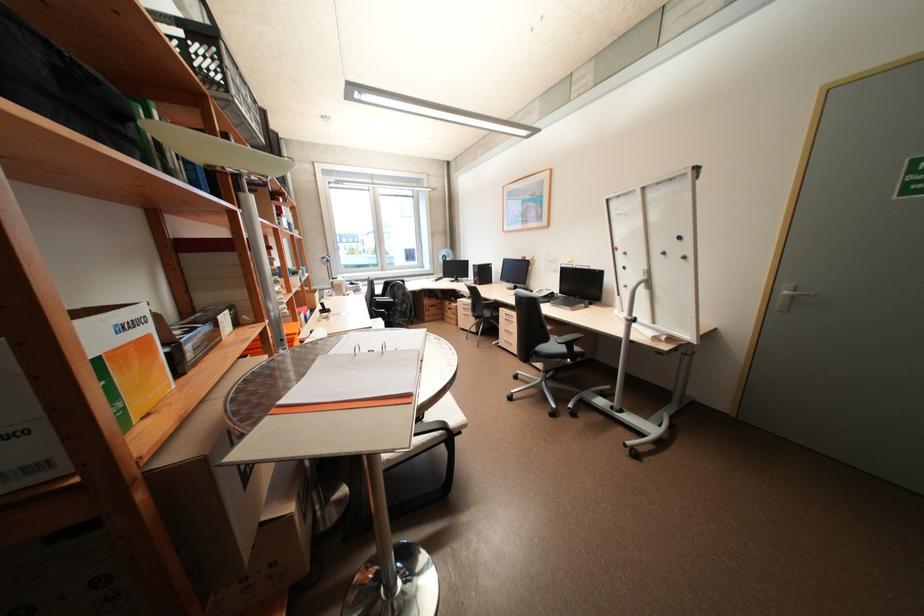
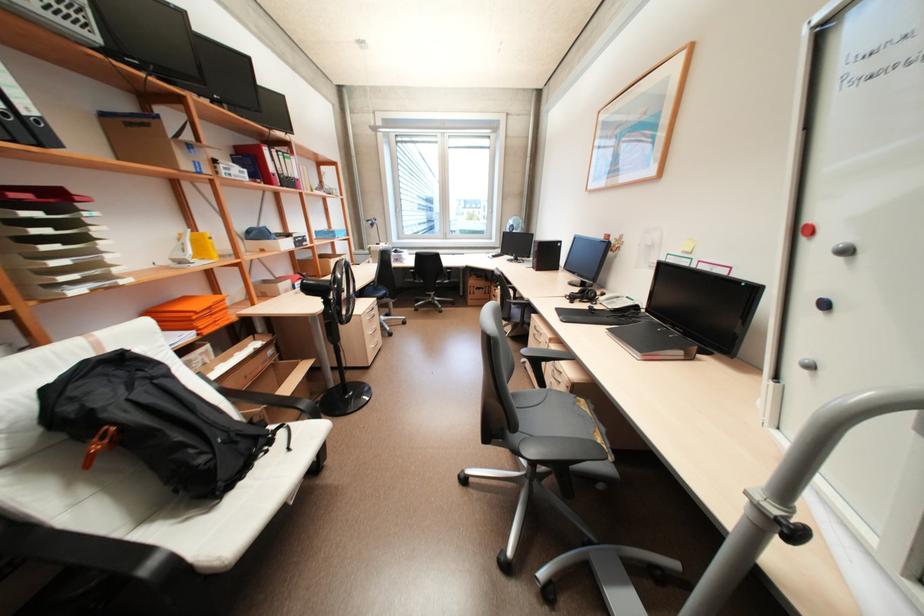
Locate, in the second image, the point that corresponds to (630,253) in the first image.

(852, 252)